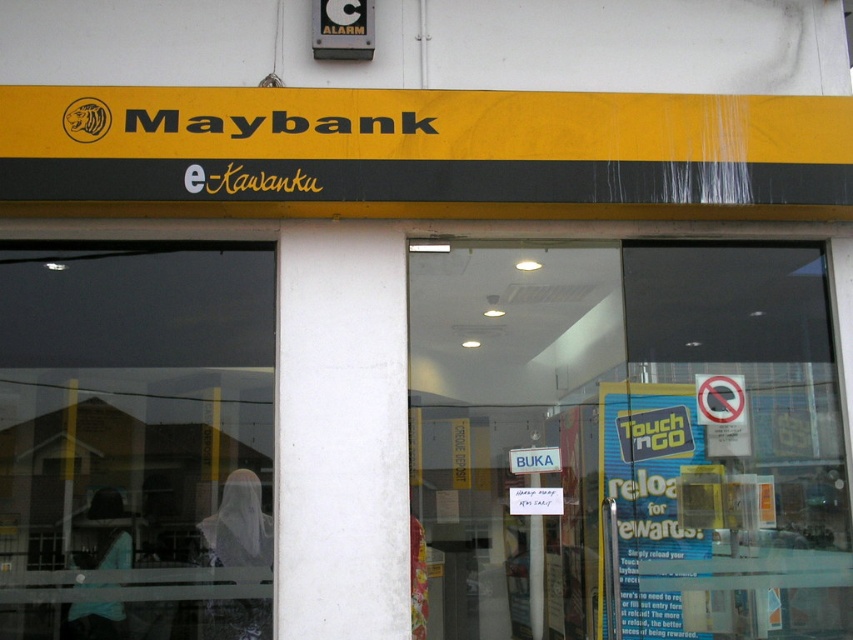
Who is positioned more to the left, transparent glass door at center or transparent glass at left?

transparent glass at left

Is point (547, 444) closer to viewer compared to point (15, 486)?

No, (547, 444) is behind (15, 486).

Between point (764, 620) and point (163, 477), which one is positioned behind?

The point (764, 620) is behind.

This screenshot has height=640, width=853. In order to click on transparent glass door at center in this screenshot , I will do `click(628, 442)`.